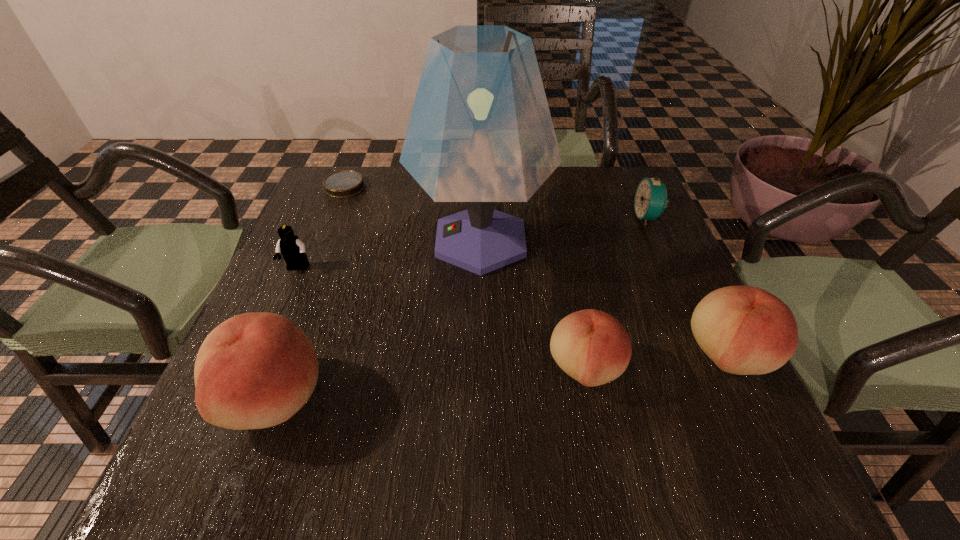
This screenshot has height=540, width=960. I want to click on compass at the far edge, so click(345, 183).

The width and height of the screenshot is (960, 540). Find the location of `alarm clock situated at the far edge`. alarm clock situated at the far edge is located at coordinates (650, 200).

Find the location of a particular element. This screenshot has width=960, height=540. peach that is at the left edge is located at coordinates (255, 370).

Where is `compass that is at the left edge`? compass that is at the left edge is located at coordinates (345, 183).

Find the location of a particular element. The width and height of the screenshot is (960, 540). Lego present at the left edge is located at coordinates (289, 245).

The height and width of the screenshot is (540, 960). In order to click on peach located at the right edge in this screenshot , I will do `click(744, 330)`.

This screenshot has width=960, height=540. Find the location of `alarm clock that is at the right edge`. alarm clock that is at the right edge is located at coordinates 650,200.

You are a GUI agent. You are given a task and a screenshot of the screen. Output one action in this format:
    pyautogui.click(x=<x>, y=<y>)
    Task: Click on the object that is at the far left corner
    
    Given the screenshot: What is the action you would take?
    pyautogui.click(x=345, y=183)

Where is `object at the near left corner`? The height and width of the screenshot is (540, 960). object at the near left corner is located at coordinates (255, 370).

You are a GUI agent. You are given a task and a screenshot of the screen. Output one action in this format:
    pyautogui.click(x=<x>, y=<y>)
    Task: Click on the object present at the far right corner
    The width and height of the screenshot is (960, 540).
    Given the screenshot: What is the action you would take?
    pyautogui.click(x=650, y=200)